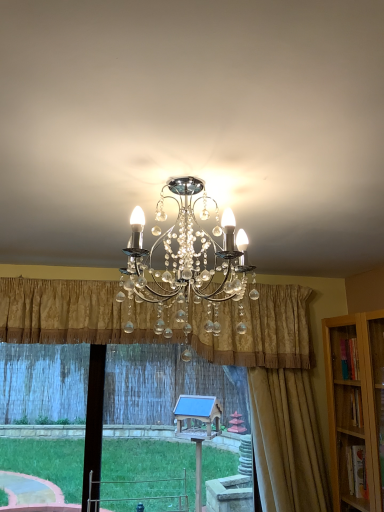
Question: Is transparent glass window at center surrounded by gold textured curtain at right, which ranks as the first curtain in right-to-left order?

Choices:
 (A) yes
 (B) no

Answer: (B)

Question: Is gold textured curtain at right, which is the 2th curtain from left to right, shorter than transparent glass window at center?

Choices:
 (A) yes
 (B) no

Answer: (B)

Question: Is gold textured curtain at right, which is the 2th curtain from left to right, completely or partially outside of transparent glass window at center?

Choices:
 (A) yes
 (B) no

Answer: (A)

Question: Does gold textured curtain at right, which ranks as the first curtain in right-to-left order, have a larger size compared to transparent glass window at center?

Choices:
 (A) yes
 (B) no

Answer: (B)

Question: Considering the relative positions of gold textured curtain at right, which is the 2th curtain from left to right, and transparent glass window at center in the image provided, is gold textured curtain at right, which is the 2th curtain from left to right, to the right of transparent glass window at center from the viewer's perspective?

Choices:
 (A) no
 (B) yes

Answer: (B)

Question: Does gold textured curtain at right, which is the 2th curtain from left to right, have a greater height compared to transparent glass window at center?

Choices:
 (A) no
 (B) yes

Answer: (B)

Question: From the image's perspective, does transparent glass window at center appear higher than gold textured curtain at center, positioned as the first curtain in left-to-right order?

Choices:
 (A) no
 (B) yes

Answer: (A)

Question: From a real-world perspective, is transparent glass window at center located beneath gold textured curtain at center, marked as the 2th curtain in a right-to-left arrangement?

Choices:
 (A) yes
 (B) no

Answer: (A)

Question: Could gold textured curtain at center, positioned as the first curtain in left-to-right order, be considered to be inside transparent glass window at center?

Choices:
 (A) no
 (B) yes

Answer: (A)

Question: Is transparent glass window at center oriented away from gold textured curtain at center, positioned as the first curtain in left-to-right order?

Choices:
 (A) yes
 (B) no

Answer: (B)

Question: Is transparent glass window at center far from gold textured curtain at center, positioned as the first curtain in left-to-right order?

Choices:
 (A) yes
 (B) no

Answer: (A)

Question: Is transparent glass window at center thinner than gold textured curtain at center, marked as the 2th curtain in a right-to-left arrangement?

Choices:
 (A) yes
 (B) no

Answer: (A)

Question: Can you confirm if gold textured curtain at center, positioned as the first curtain in left-to-right order, is bigger than gold textured curtain at right, which ranks as the first curtain in right-to-left order?

Choices:
 (A) no
 (B) yes

Answer: (B)